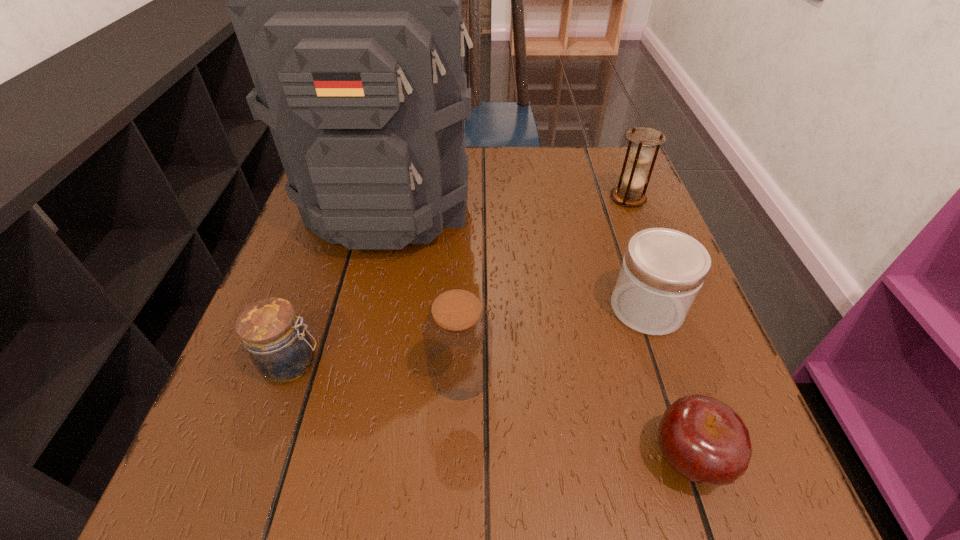
Where is `free location that satisfies the following two spatial constraints: 1. on the lid of the nearest object; 2. on the right side of the leftmost jar`? free location that satisfies the following two spatial constraints: 1. on the lid of the nearest object; 2. on the right side of the leftmost jar is located at coordinates (260, 457).

Locate an element on the screen. blank space that satisfies the following two spatial constraints: 1. on the lid of the leftmost jar; 2. on the back side of the second jar from left to right is located at coordinates (289, 372).

Locate an element on the screen. This screenshot has width=960, height=540. vacant space that satisfies the following two spatial constraints: 1. on the back side of the hourglass; 2. on the right side of the nearest object is located at coordinates (604, 198).